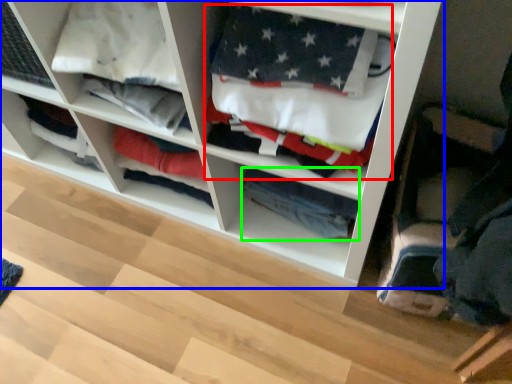
Question: Which object is the closest to the clothing (highlighted by a red box)? Choose among these: shelf (highlighted by a blue box) or clothing (highlighted by a green box).

Choices:
 (A) shelf
 (B) clothing

Answer: (A)